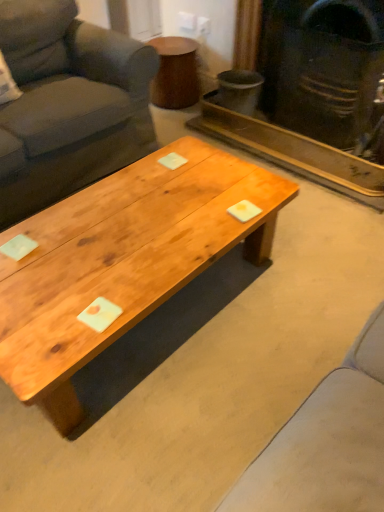
The width and height of the screenshot is (384, 512). Identify the location of free location above natural wood coffee table at center (from a real-world perspective). (127, 217).